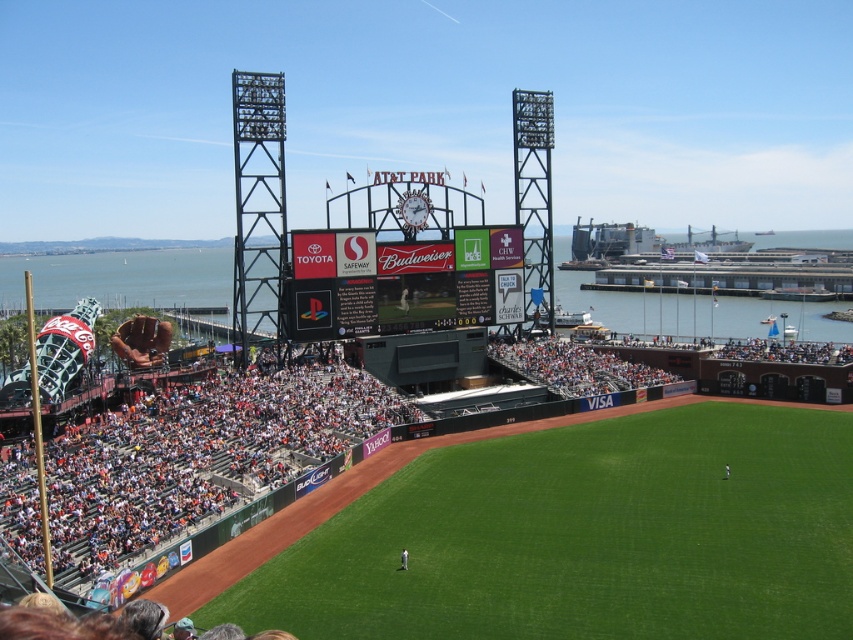
You are a photographer standing at the edge of the field at AT T Park. You want to take a picture of the green grass at center and the black matte scoreboard at center. Which object will appear taller in your photo?

The black matte scoreboard at center will appear taller in the photo because the green grass at center has a lesser height compared to it.

You are a spectator at AT T Park and you want to find the black matte scoreboard at center. From your current position, which direction should you look to see it relative to the green grass at center?

The green grass at center is to the right of the black matte scoreboard at center, so you should look to your left to see the black matte scoreboard at center relative to the green grass at center.

You are a photographer planning to capture a wide shot of the baseball field. You want to ensure that both the green grass at center and the black matte scoreboard at center are clearly visible in your photo. Based on their sizes, which object should you prioritize positioning closer to the camera to maintain detail?

The green grass at center has a larger width than the black matte scoreboard at center. To maintain detail for both, prioritize positioning the green grass at center closer to the camera since its larger size may require more focus to capture its details effectively.